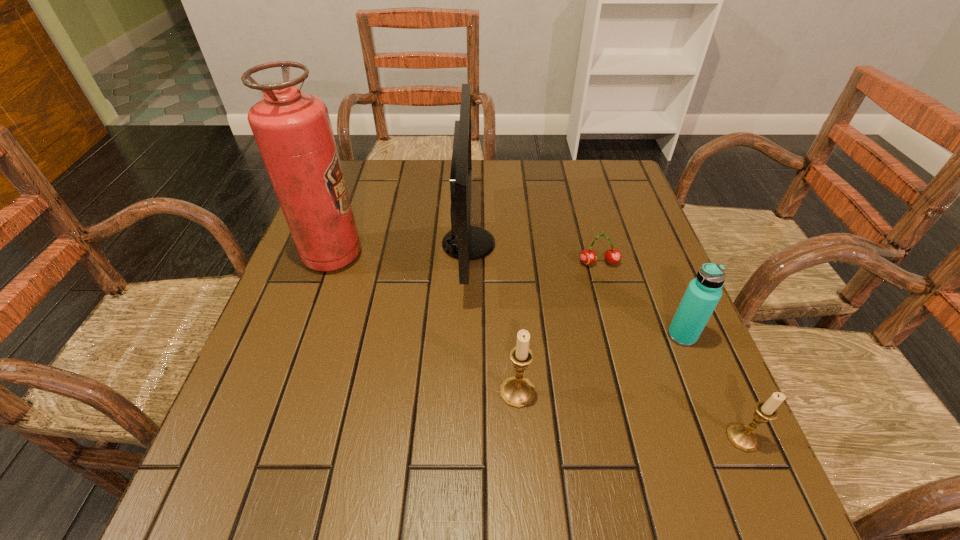
Find the location of a particular element. free spot between the second tallest object and the water bottle is located at coordinates (575, 289).

Locate an element on the screen. The height and width of the screenshot is (540, 960). vacant area between the computer monitor and the shortest object is located at coordinates (534, 253).

What are the coordinates of `free space that is in between the computer monitor and the left candle holder` in the screenshot? It's located at (493, 318).

This screenshot has height=540, width=960. I want to click on free spot between the left candle holder and the nearer candle holder, so click(x=630, y=415).

Find the location of a particular element. free space between the farther candle holder and the right candle holder is located at coordinates (630, 415).

Where is `free space between the nearest object and the left candle holder`? The image size is (960, 540). free space between the nearest object and the left candle holder is located at coordinates (630, 415).

The height and width of the screenshot is (540, 960). I want to click on vacant point located between the shorter candle holder and the computer monitor, so click(606, 341).

This screenshot has height=540, width=960. In order to click on empty space between the right candle holder and the second tallest object in this screenshot , I will do `click(606, 341)`.

Locate which object ranks fifth in proximity to the computer monitor. Please provide its 2D coordinates. Your answer should be formatted as a tuple, i.e. [(x, y)], where the tuple contains the x and y coordinates of a point satisfying the conditions above.

[(743, 437)]

I want to click on object that is the fourth closest to the fourth farthest object, so click(x=464, y=242).